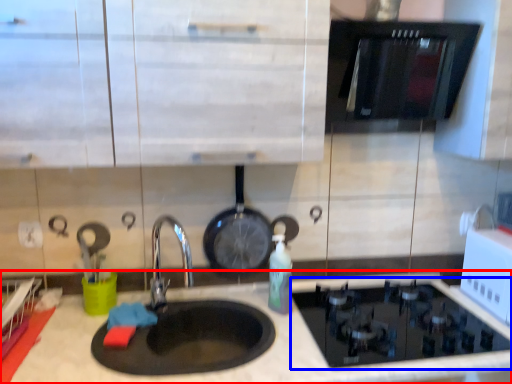
Question: Among these objects, which one is nearest to the camera, countertop (highlighted by a red box) or gas stove (highlighted by a blue box)?

Choices:
 (A) countertop
 (B) gas stove

Answer: (A)